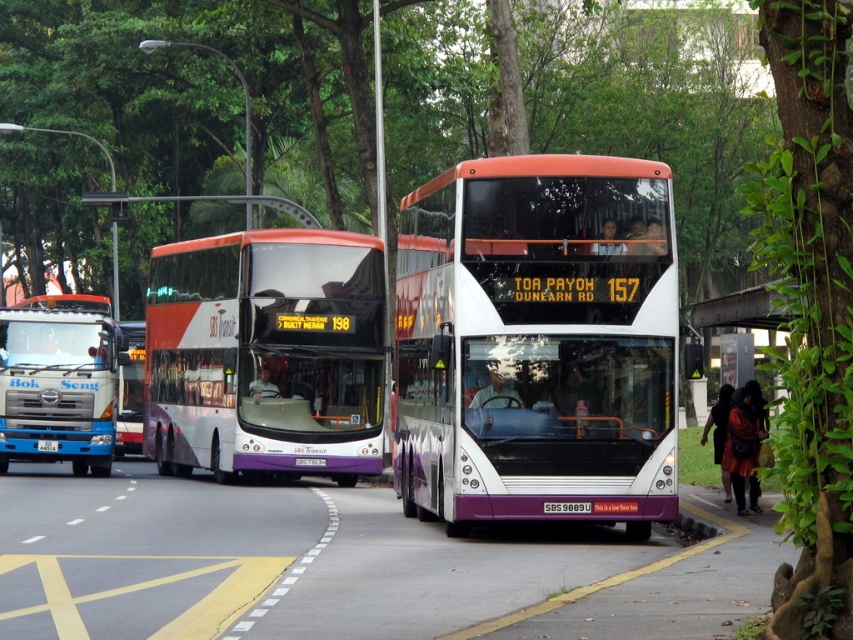
You are a passenger waiting at the metallic silver bus stop at right and want to board the white glossy bus at center. Is the bus in front of or behind the bus stop?

The white glossy bus at center is positioned on the left side of the metallic silver bus stop at right, so it is in front of the bus stop.

You are a city planner analyzing traffic flow. You observe the matte purple bus at center and the purple plastic license plate at center. Which object is wider?

The matte purple bus at center is wider than the purple plastic license plate at center.